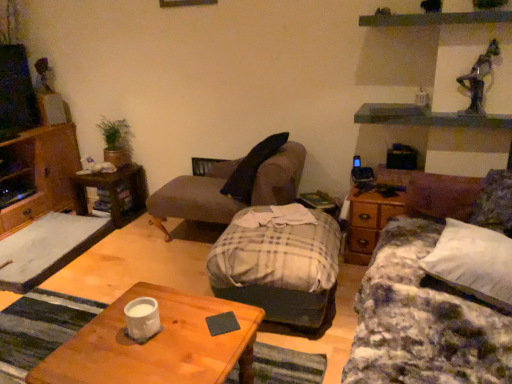
Find the location of a particular element. Image resolution: width=512 pixels, height=384 pixels. vacant space to the left of white matte coffee cup at lower left is located at coordinates (95, 337).